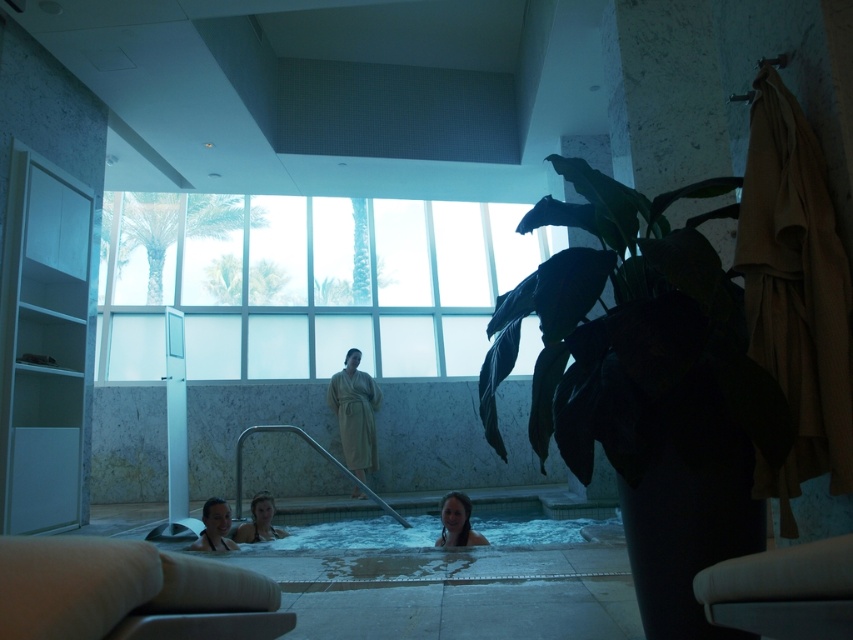
You are a photographer setting up a shot of the smooth skin person at lower center and the smooth white swimsuit at lower center in the spa scene. Which object should you focus on first if you want to capture the taller one?

The smooth skin person at lower center is taller than the smooth white swimsuit at lower center, so you should focus on the smooth skin person at lower center first.

You are a photographer taking a picture of the smooth skin person at lower center and the smooth white swimsuit at lower center. Which object should you focus on first if you want to capture both in the same frame?

The smooth skin person at lower center should be focused on first because they are positioned on the right side of the smooth white swimsuit at lower center, so adjusting focus from the person to the swimsuit would ensure both are in frame.